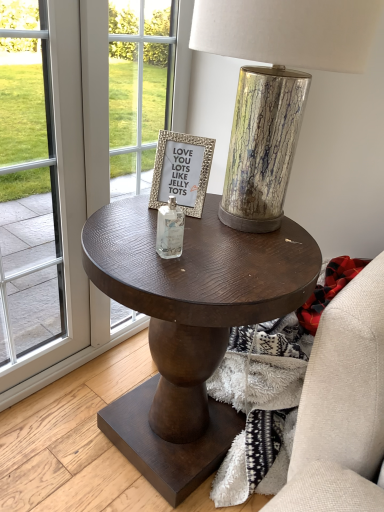
Describe the element at coordinates (279, 78) in the screenshot. The width and height of the screenshot is (384, 512). I see `metallic cracked glass table lamp at center` at that location.

The image size is (384, 512). Find the location of `dark wood side table at center`. dark wood side table at center is located at coordinates (189, 327).

What is the approximate height of clear glass bottle at center?

The height of clear glass bottle at center is 4.31 inches.

Measure the distance between point (151, 204) and camera.

3.42 feet.

Find the location of a particular element. Image resolution: width=384 pixels, height=512 pixels. gold textured frame at center is located at coordinates (181, 170).

I want to click on metallic cracked glass table lamp at center, so click(279, 78).

Locate an element on the screen. The height and width of the screenshot is (512, 384). table lamp on the right of dark wood side table at center is located at coordinates (279, 78).

Which object is closer to the camera taking this photo, dark wood side table at center or metallic cracked glass table lamp at center?

metallic cracked glass table lamp at center is in front.

Visually, is dark wood side table at center positioned to the left or to the right of metallic cracked glass table lamp at center?

In the image, dark wood side table at center appears on the left side of metallic cracked glass table lamp at center.

Looking at the image, does clear glass bottle at center seem bigger or smaller compared to gold textured frame at center?

clear glass bottle at center is smaller than gold textured frame at center.

Is gold textured frame at center a part of clear glass bottle at center?

No, clear glass bottle at center does not contain gold textured frame at center.

Is clear glass bottle at center not close to gold textured frame at center?

Actually, clear glass bottle at center and gold textured frame at center are a little close together.

Considering the points (168, 201) and (181, 157), which point is behind, point (168, 201) or point (181, 157)?

The point (181, 157) is behind.

Is transparent glass screen door at left thinner than gold textured frame at center?

Indeed, transparent glass screen door at left has a lesser width compared to gold textured frame at center.

Could you tell me if transparent glass screen door at left is turned towards gold textured frame at center?

No, transparent glass screen door at left does not turn towards gold textured frame at center.

Is point (40, 323) closer or farther from the camera than point (176, 156)?

Point (40, 323).

Is transparent glass screen door at left smaller than gold textured frame at center?

Actually, transparent glass screen door at left might be larger than gold textured frame at center.

Looking at their sizes, would you say clear glass bottle at center is wider or thinner than dark wood side table at center?

In the image, clear glass bottle at center appears to be more narrow than dark wood side table at center.

Can we say clear glass bottle at center lies outside dark wood side table at center?

Indeed, clear glass bottle at center is completely outside dark wood side table at center.

Looking at this image, how far apart are clear glass bottle at center and dark wood side table at center?

The distance of clear glass bottle at center from dark wood side table at center is 11.72 inches.

Does point (157, 229) come closer to viewer compared to point (149, 481)?

Yes, point (157, 229) is in front of point (149, 481).

Which is closer, (x=182, y=162) or (x=172, y=248)?

The point (x=172, y=248) is closer.

Who is smaller, gold textured frame at center or clear glass bottle at center?

clear glass bottle at center.

Is gold textured frame at center wider or thinner than clear glass bottle at center?

Considering their sizes, gold textured frame at center looks broader than clear glass bottle at center.

Is gold textured frame at center touching clear glass bottle at center?

No, gold textured frame at center is not touching clear glass bottle at center.

Is dark wood side table at center at the left side of gold textured frame at center?

In fact, dark wood side table at center is to the right of gold textured frame at center.

Is dark wood side table at center shorter than gold textured frame at center?

In fact, dark wood side table at center may be taller than gold textured frame at center.

Does dark wood side table at center have a smaller size compared to gold textured frame at center?

No, dark wood side table at center is not smaller than gold textured frame at center.

Is transparent glass screen door at left placed right next to clear glass bottle at center?

No.

Is transparent glass screen door at left closer to the viewer compared to clear glass bottle at center?

Yes, it is.

Which is more to the right, transparent glass screen door at left or clear glass bottle at center?

clear glass bottle at center.

Does transparent glass screen door at left have a lesser height compared to clear glass bottle at center?

No.

Locate an element on the screen. This screenshot has width=384, height=512. table lamp to the right of dark wood side table at center is located at coordinates (279, 78).

Find the location of a particular element. The image size is (384, 512). bottle that is under the gold textured frame at center (from a real-world perspective) is located at coordinates (170, 229).

Looking at the image, which one is located closer to transparent glass screen door at left, clear glass bottle at center or dark wood side table at center?

dark wood side table at center lies closer to transparent glass screen door at left than the other object.

From the image, which object appears to be farther from clear glass bottle at center, dark wood side table at center or metallic cracked glass table lamp at center?

dark wood side table at center is positioned further to the anchor clear glass bottle at center.

From the image, which object appears to be farther from dark wood side table at center, gold textured frame at center or transparent glass screen door at left?

transparent glass screen door at left is positioned further to the anchor dark wood side table at center.

Estimate the real-world distances between objects in this image. Which object is closer to dark wood side table at center, clear glass bottle at center or metallic cracked glass table lamp at center?

The object closer to dark wood side table at center is clear glass bottle at center.

Looking at the image, which one is located further to transparent glass screen door at left, clear glass bottle at center or gold textured frame at center?

clear glass bottle at center is positioned further to the anchor transparent glass screen door at left.

Looking at the image, which one is located closer to dark wood side table at center, gold textured frame at center or clear glass bottle at center?

gold textured frame at center is closer to dark wood side table at center.

From the image, which object appears to be nearer to clear glass bottle at center, transparent glass screen door at left or dark wood side table at center?

dark wood side table at center is positioned closer to the anchor clear glass bottle at center.

When comparing their distances from transparent glass screen door at left, does metallic cracked glass table lamp at center or gold textured frame at center seem further?

metallic cracked glass table lamp at center is further to transparent glass screen door at left.

I want to click on bottle positioned between metallic cracked glass table lamp at center and gold textured frame at center from near to far, so click(x=170, y=229).

Identify the location of picture frame located between transparent glass screen door at left and metallic cracked glass table lamp at center in the left-right direction. The width and height of the screenshot is (384, 512). (181, 170).

Identify the location of bottle between transparent glass screen door at left and metallic cracked glass table lamp at center from left to right. The width and height of the screenshot is (384, 512). (170, 229).

Identify the location of bottle between transparent glass screen door at left and gold textured frame at center in the horizontal direction. (170, 229).